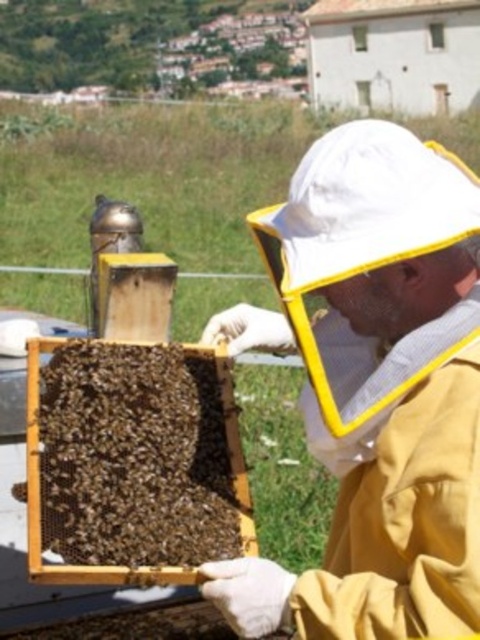
You are a beekeeper standing next to the beehive. You want to check if your yellow fabric beekeeper suit at center is positioned correctly for inspecting the brown wooden beehive at center. Based on the scene, is your suit above or below the beehive?

The yellow fabric beekeeper suit at center is above the brown wooden beehive at center, which is the correct position for inspecting the hive safely.